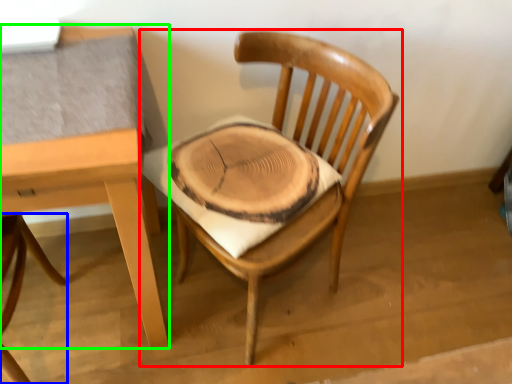
Question: Which object is positioned farthest from chair (highlighted by a red box)? Select from chair (highlighted by a blue box) and table (highlighted by a green box).

Choices:
 (A) chair
 (B) table

Answer: (A)